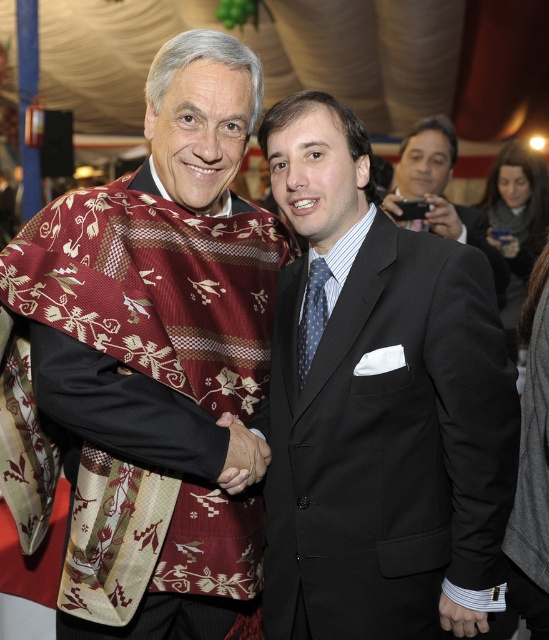
Question: Which point appears farthest from the camera in this image?

Choices:
 (A) (307, 333)
 (B) (170, 280)

Answer: (B)

Question: Does maroon woven shawl at center appear over black satin suit at center?

Choices:
 (A) yes
 (B) no

Answer: (A)

Question: Which is farther from the polka dot silk tie at center?

Choices:
 (A) maroon woven shawl at center
 (B) black satin suit at center

Answer: (A)

Question: Which point is closer to the camera taking this photo?

Choices:
 (A) (121, 528)
 (B) (408, 172)
 (C) (323, 298)

Answer: (A)

Question: Is maroon woven shawl at center wider than polka dot silk tie at center?

Choices:
 (A) yes
 (B) no

Answer: (A)

Question: In this image, where is dark gray suit at center located relative to polka dot silk tie at center?

Choices:
 (A) above
 (B) below

Answer: (A)